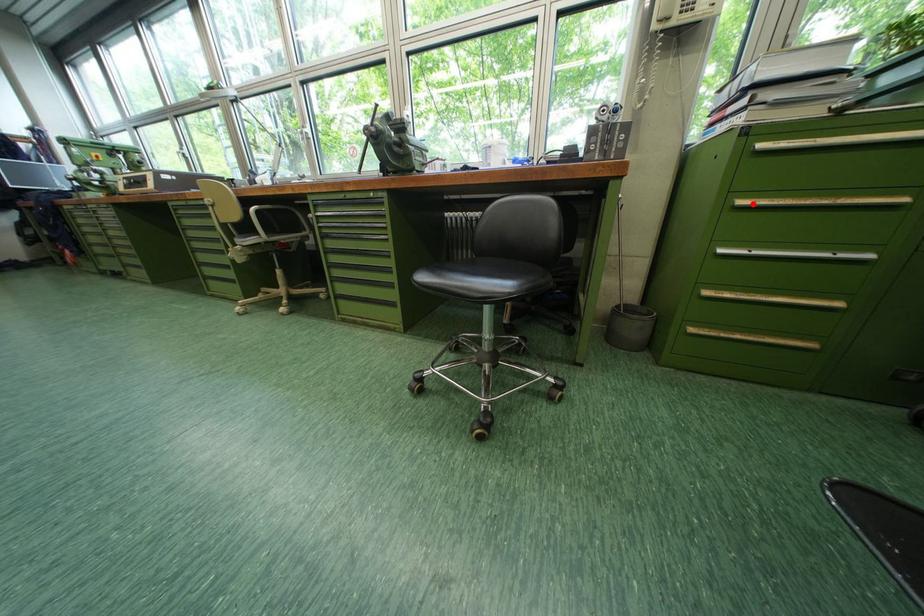
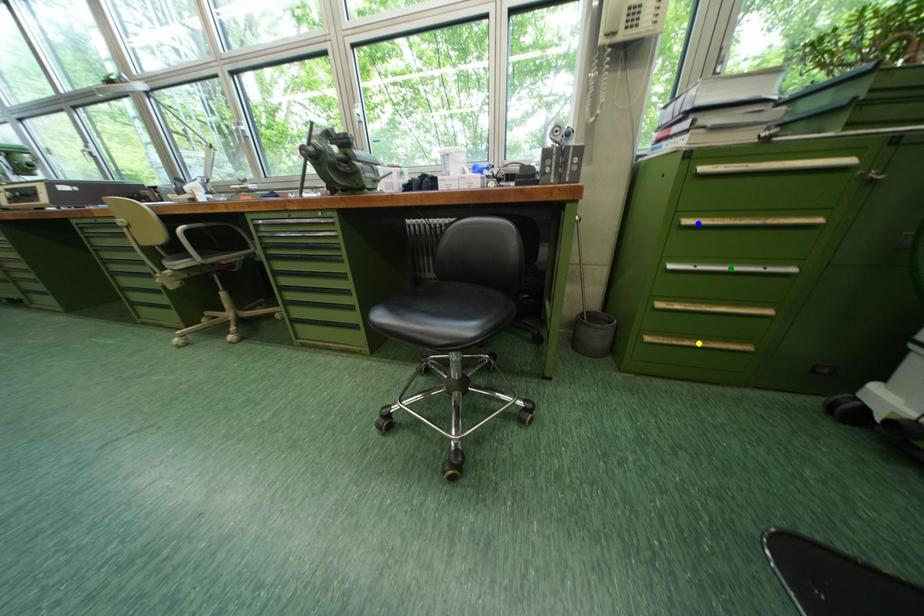
Question: I am providing you with two images of the same scene from different viewpoints. A red point is marked on the first image. You are given multiple points on the second image. Which mark in image 2 goes with the point in image 1?

Choices:
 (A) yellow point
 (B) green point
 (C) blue point

Answer: (C)